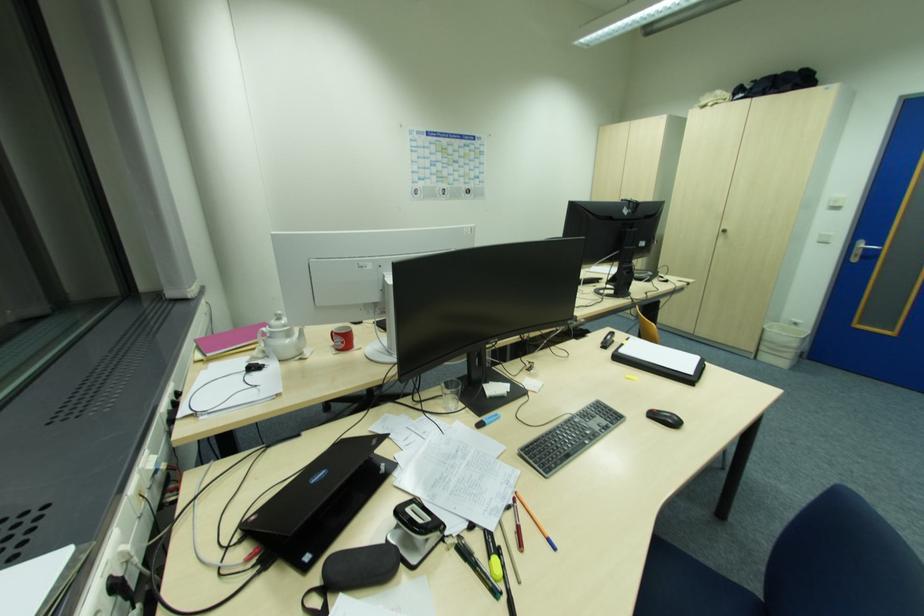
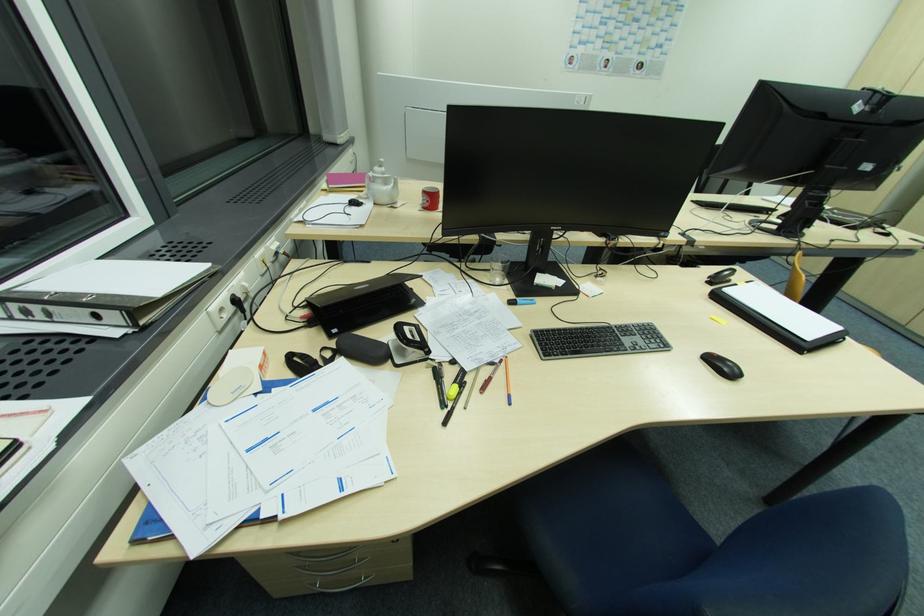
Locate, in the second image, the point that corresponds to point 468,565 in the first image.

(436, 383)